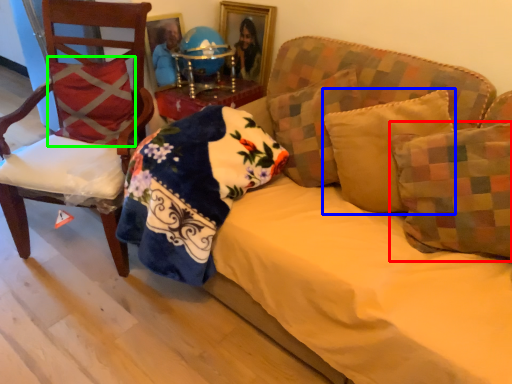
Question: Based on their relative distances, which object is nearer to pillow (highlighted by a red box)? Choose from pillow (highlighted by a blue box) and pillow (highlighted by a green box).

Choices:
 (A) pillow
 (B) pillow

Answer: (A)